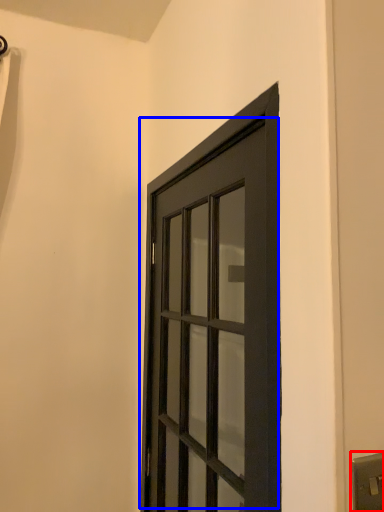
Question: Which object appears closest to the camera in this image, light switch (highlighted by a red box) or door (highlighted by a blue box)?

Choices:
 (A) light switch
 (B) door

Answer: (A)